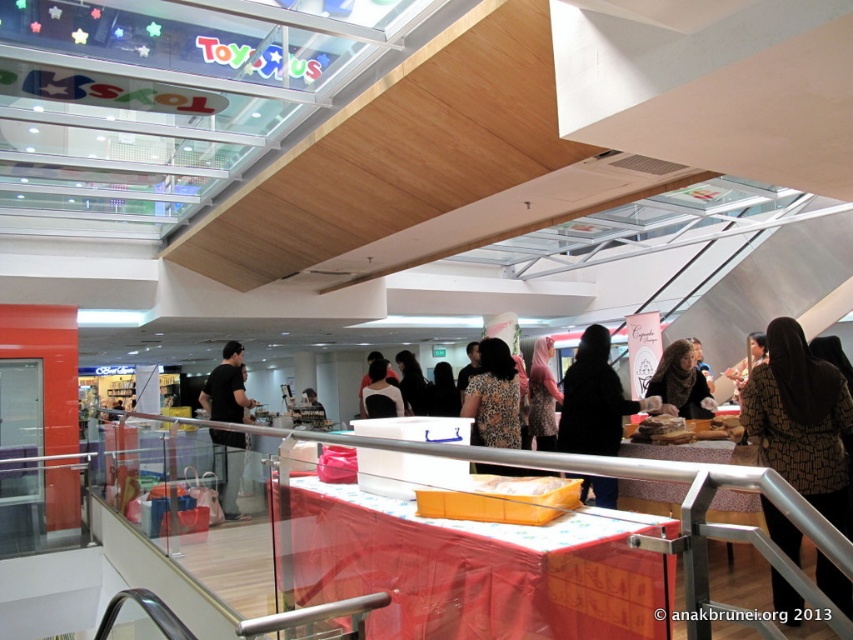
You are standing in the shopping mall and see the matte brown scarf at center and the black hair at center. Which object is positioned closer to you?

The matte brown scarf at center is closer to the viewer than the black hair at center.

In the scene shown: You are standing in the shopping mall and see the black fabric at center and the brown printed dress at center. Which one is closer to you?

The black fabric at center is closer to you because it is in front of the brown printed dress at center.

You are a customer at the mall and you see the black fabric at center and the brown printed dress at center displayed on the table. Which item takes up more space on the table?

The black fabric at center is larger in size than the brown printed dress at center, so it takes up more space on the table.